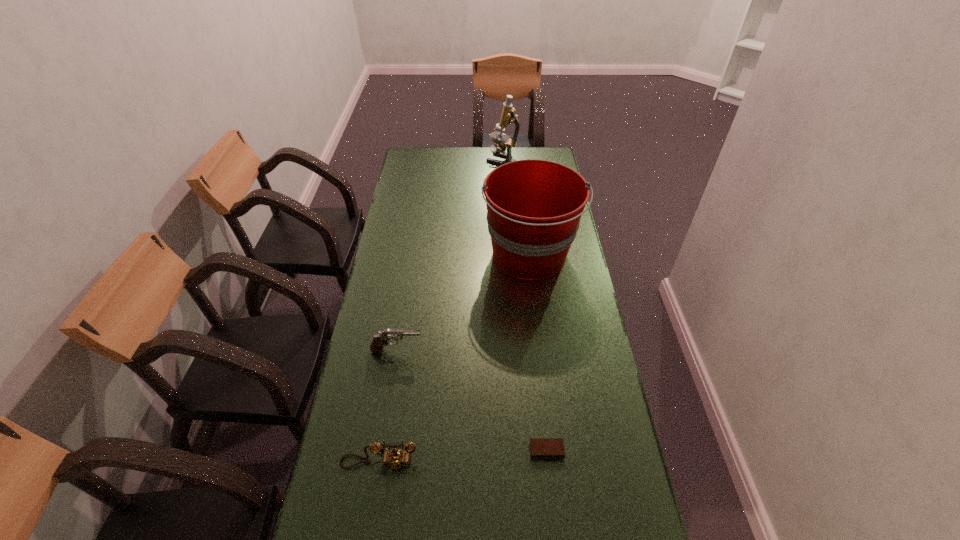
Where is `free space between the telephone and the microscope`? Image resolution: width=960 pixels, height=540 pixels. free space between the telephone and the microscope is located at coordinates (441, 310).

This screenshot has width=960, height=540. In order to click on vacant area between the microscope and the telephone in this screenshot , I will do `click(441, 310)`.

The image size is (960, 540). I want to click on vacant area that lies between the telephone and the shortest object, so click(x=463, y=456).

At what (x,y) coordinates should I click in order to perform the action: click on empty space between the microscope and the alarm clock. Please return your answer as a coordinate pair (x, y). Image resolution: width=960 pixels, height=540 pixels. Looking at the image, I should click on (524, 305).

At what (x,y) coordinates should I click in order to perform the action: click on vacant point located between the third nearest object and the shortest object. Please return your answer as a coordinate pair (x, y). Image resolution: width=960 pixels, height=540 pixels. Looking at the image, I should click on (472, 401).

I want to click on empty location between the fourth nearest object and the third nearest object, so click(x=464, y=303).

You are a GUI agent. You are given a task and a screenshot of the screen. Output one action in this format:
    pyautogui.click(x=<x>, y=<y>)
    Task: Click on the vacant space that's between the third nearest object and the alarm clock
    
    Given the screenshot: What is the action you would take?
    pyautogui.click(x=472, y=401)

At what (x,y) coordinates should I click in order to perform the action: click on vacant region between the second farthest object and the third nearest object. Please return your answer as a coordinate pair (x, y). The height and width of the screenshot is (540, 960). Looking at the image, I should click on (464, 303).

You are a GUI agent. You are given a task and a screenshot of the screen. Output one action in this format:
    pyautogui.click(x=<x>, y=<y>)
    Task: Click on the free space between the third farthest object and the fourth nearest object
    The image size is (960, 540).
    Given the screenshot: What is the action you would take?
    pyautogui.click(x=464, y=303)

Choose which object is the fourth nearest neighbor to the telephone. Please provide its 2D coordinates. Your answer should be formatted as a tuple, i.e. [(x, y)], where the tuple contains the x and y coordinates of a point satisfying the conditions above.

[(508, 116)]